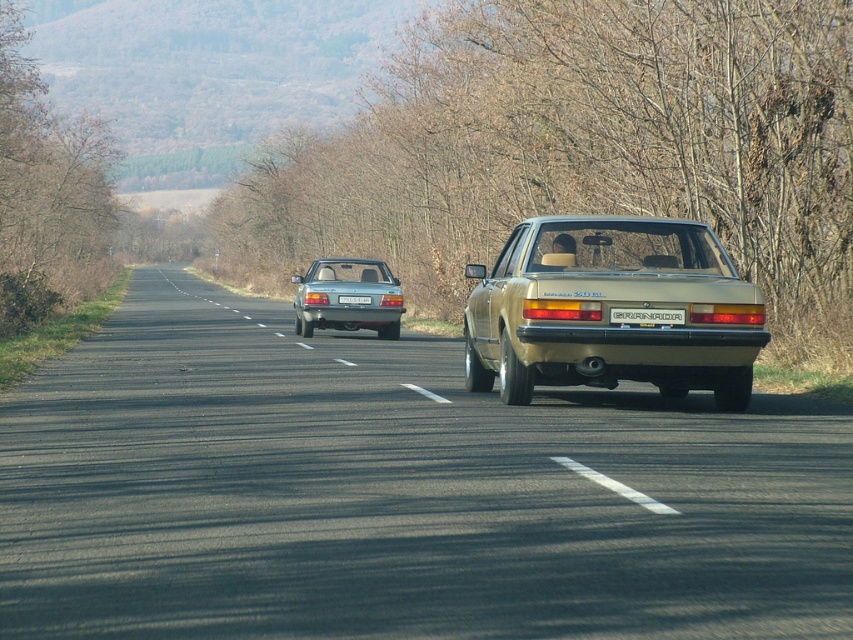
Question: Can you confirm if black plastic license plate at center is smaller than white plastic license plate at center?

Choices:
 (A) no
 (B) yes

Answer: (B)

Question: Can you confirm if satin silver sedan at center is positioned above white plastic license plate at center?

Choices:
 (A) no
 (B) yes

Answer: (A)

Question: Which of these objects is positioned farthest from the gold metallic sedan at center?

Choices:
 (A) black plastic license plate at center
 (B) white plastic license plate at center

Answer: (B)

Question: Which point is closer to the camera?

Choices:
 (A) satin silver sedan at center
 (B) white plastic license plate at center
 (C) gold metallic sedan at center
 (D) black plastic license plate at center

Answer: (C)

Question: Among these points, which one is nearest to the camera?

Choices:
 (A) (389, 308)
 (B) (566, 250)
 (C) (358, 300)

Answer: (B)

Question: Observing the image, what is the correct spatial positioning of gold metallic sedan at center in reference to white plastic license plate at center?

Choices:
 (A) above
 (B) below

Answer: (A)